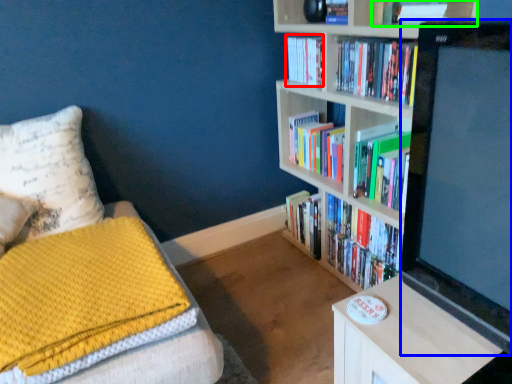
Question: Which is farther away from book (highlighted by a red box)? computer monitor (highlighted by a blue box) or book (highlighted by a green box)?

Choices:
 (A) computer monitor
 (B) book

Answer: (A)